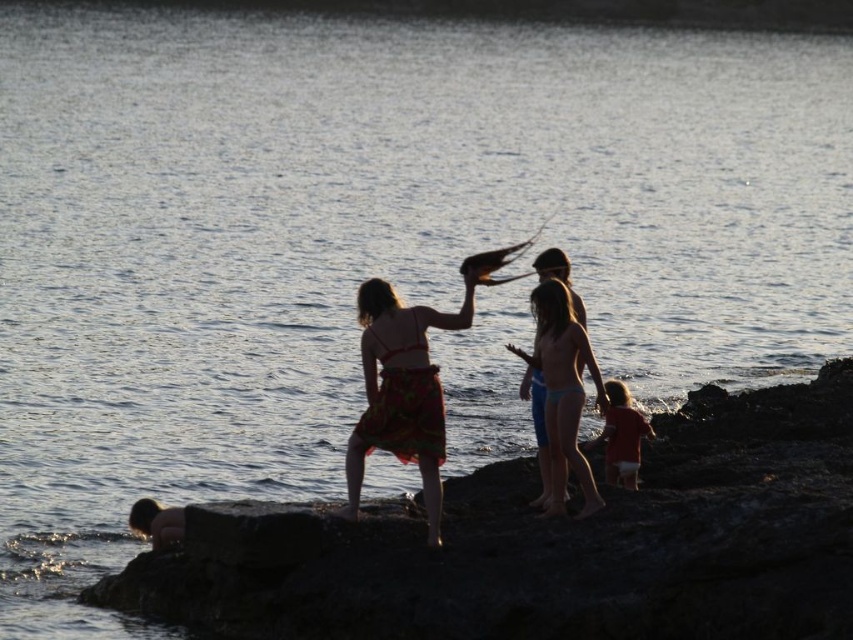
Question: Where is silhouette floral skirt at center located in relation to red matte shirt at lower right in the image?

Choices:
 (A) right
 (B) left

Answer: (B)

Question: Which object is closer to the camera taking this photo?

Choices:
 (A) matte pink bikini at center
 (B) silhouette floral skirt at center
 (C) red matte shirt at lower right

Answer: (A)

Question: Is silhouette floral skirt at center thinner than red matte shirt at lower right?

Choices:
 (A) no
 (B) yes

Answer: (B)

Question: Which object is farther from the camera taking this photo?

Choices:
 (A) silhouette floral skirt at center
 (B) matte pink bikini at center
 (C) red matte shirt at lower right

Answer: (C)

Question: Which point appears closest to the camera in this image?

Choices:
 (A) (653, 436)
 (B) (376, 413)
 (C) (589, 352)

Answer: (B)

Question: Is silhouette floral skirt at center to the right of matte pink bikini at center from the viewer's perspective?

Choices:
 (A) no
 (B) yes

Answer: (A)